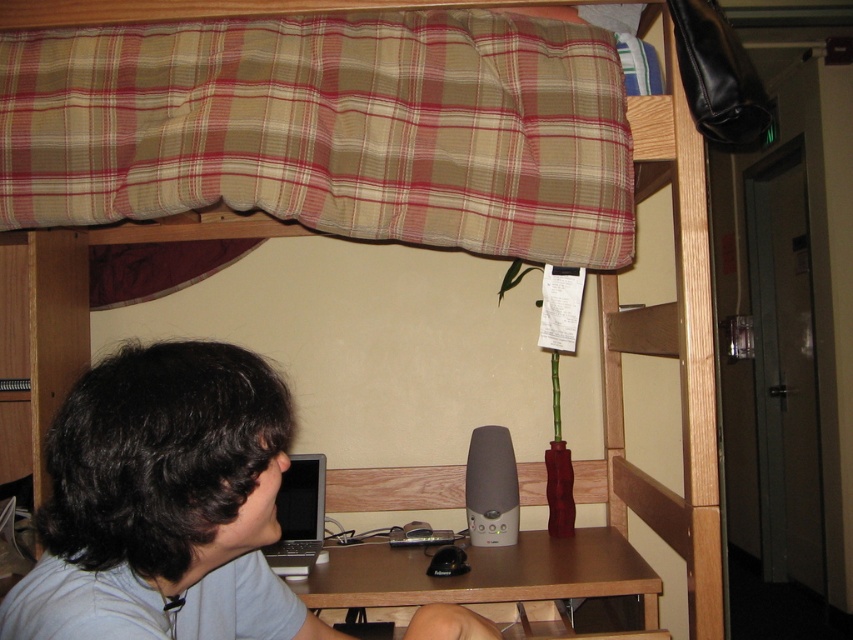
Question: Does light blue cotton shirt at center appear over silver metallic laptop at lower center?

Choices:
 (A) no
 (B) yes

Answer: (B)

Question: Which of the following is the closest to the observer?

Choices:
 (A) silver metallic laptop at lower center
 (B) brown wooden table at lower center
 (C) plaid fabric curtain at upper center
 (D) light blue cotton shirt at center

Answer: (D)

Question: Does light blue cotton shirt at center have a greater width compared to brown wooden table at lower center?

Choices:
 (A) no
 (B) yes

Answer: (A)

Question: Does light blue cotton shirt at center appear on the right side of silver metallic laptop at lower center?

Choices:
 (A) yes
 (B) no

Answer: (A)

Question: Which point is closer to the camera taking this photo?

Choices:
 (A) pyautogui.click(x=317, y=509)
 (B) pyautogui.click(x=444, y=97)
 (C) pyautogui.click(x=117, y=548)

Answer: (C)

Question: Which of the following is the closest to the observer?

Choices:
 (A) (0, 81)
 (B) (323, 458)
 (C) (520, 627)

Answer: (A)